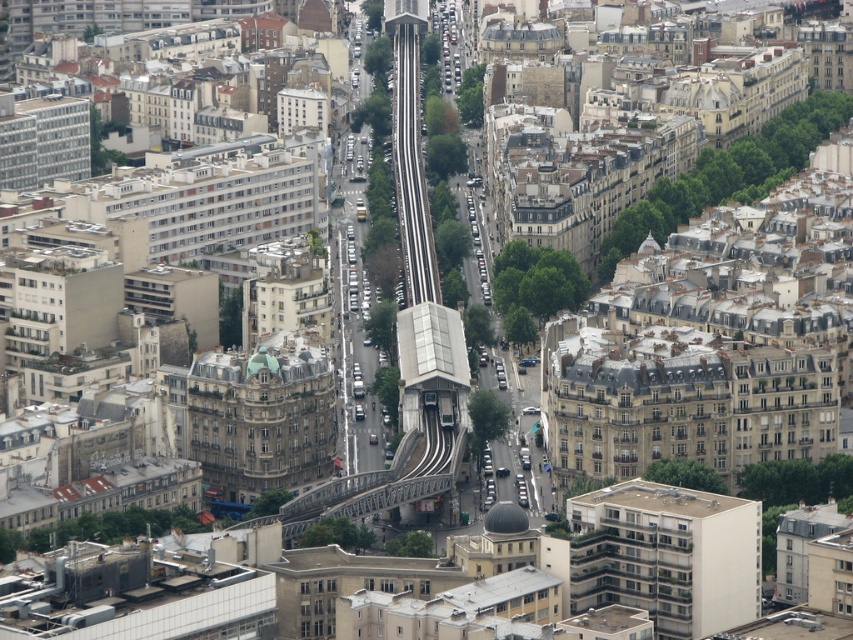
Is white smooth building at center shorter than black rubber train track at center?

Yes.

Who is more distant from viewer, (730, 624) or (428, 273)?

The point (428, 273) is behind.

Where is `white smooth building at center`? white smooth building at center is located at coordinates (666, 556).